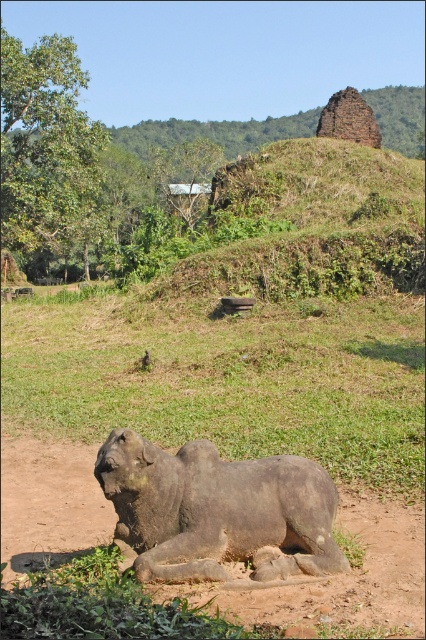
You are a gardener who wants to water the green grass at lower center. The gray stone elephant at lower center is blocking your path. Can you move the elephant to access the grass?

The gray stone elephant at lower center is behind the green grass at lower center, so you don not need to move the elephant to access the grass since it is already positioned behind it.

You are a gardener who wants to plant a new flower bed between the green grass at lower center and the gray stone elephant at lower center. Since the flower bed requires a minimum of 10 cm of soil depth, can you determine if there is enough space between the two objects?

The green grass at lower center is taller than the gray stone elephant at lower center, so there is sufficient space between them for the flower bed with the required 10 cm soil depth.